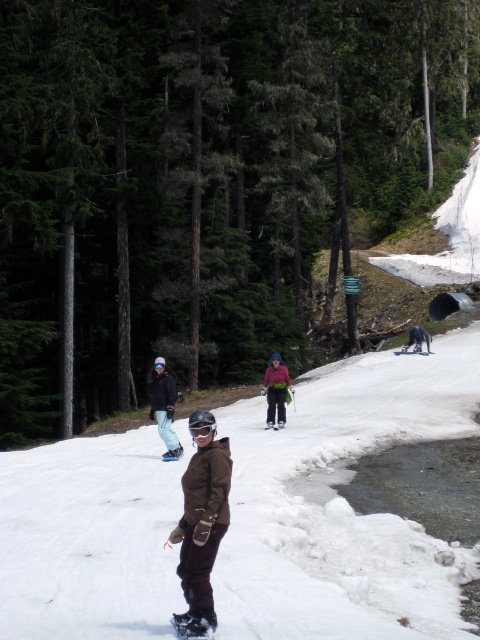
Question: Does brown snowboard at center have a lesser width compared to dark blue snowboard at center?

Choices:
 (A) no
 (B) yes

Answer: (A)

Question: Is brown suede snowboard at center to the right of matte black snowboarder at center from the viewer's perspective?

Choices:
 (A) no
 (B) yes

Answer: (B)

Question: Which point appears closest to the camera in this image?

Choices:
 (A) (210, 634)
 (B) (271, 419)

Answer: (A)

Question: Which of the following is the farthest from the observer?

Choices:
 (A) (214, 612)
 (B) (414, 332)

Answer: (B)

Question: Can you confirm if black matte snowboard at center is positioned to the right of dark blue snowboard at center?

Choices:
 (A) no
 (B) yes

Answer: (A)

Question: Among these points, which one is nearest to the camera?

Choices:
 (A) (166, 408)
 (B) (179, 634)
 (C) (192, 474)
 (D) (409, 344)

Answer: (B)